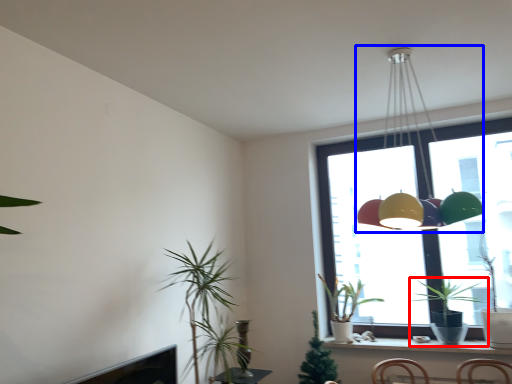
Question: Which object appears farthest to the camera in this image, houseplant (highlighted by a red box) or lamp (highlighted by a blue box)?

Choices:
 (A) houseplant
 (B) lamp

Answer: (A)